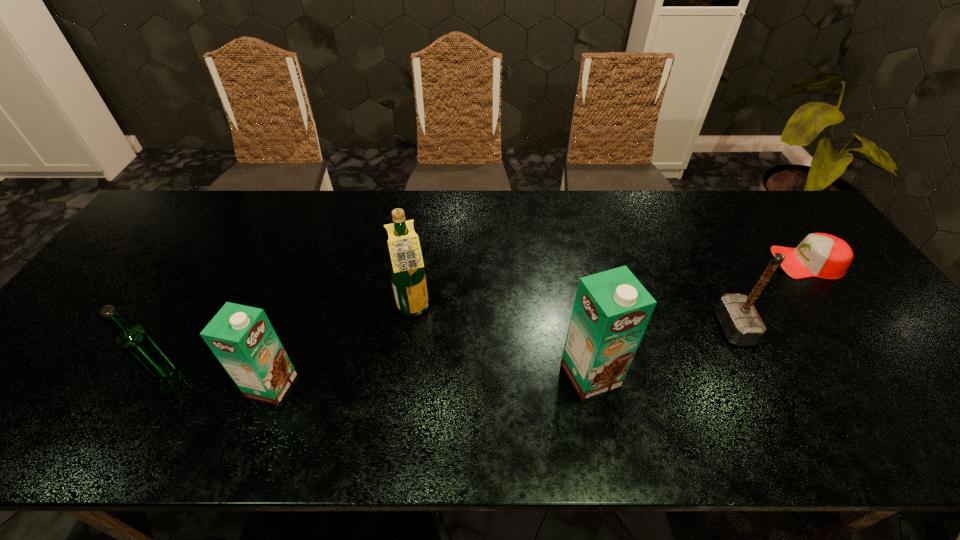
Identify the location of object at the right edge. (822, 255).

At what (x,y) coordinates should I click in order to perform the action: click on free point at the far edge. Please return your answer as a coordinate pair (x, y). This screenshot has height=540, width=960. Looking at the image, I should click on (303, 230).

You are a GUI agent. You are given a task and a screenshot of the screen. Output one action in this format:
    pyautogui.click(x=<x>, y=<y>)
    Task: Click on the vacant position at the left edge of the desktop
    This screenshot has height=540, width=960.
    Given the screenshot: What is the action you would take?
    pyautogui.click(x=154, y=249)

This screenshot has width=960, height=540. Find the location of `vacant space at the right edge`. vacant space at the right edge is located at coordinates (809, 297).

The width and height of the screenshot is (960, 540). In the image, there is a desktop. Find the location of `blank space at the far right corner`. blank space at the far right corner is located at coordinates (770, 228).

In the image, there is a desktop. At what (x,y) coordinates should I click in order to perform the action: click on vacant area at the near right corner. Please return your answer as a coordinate pair (x, y). The height and width of the screenshot is (540, 960). Looking at the image, I should click on (860, 372).

I want to click on vacant region between the beer bottle and the shortest object, so click(x=485, y=317).

At what (x,y) coordinates should I click in order to perform the action: click on free space between the leftmost object and the second object from left to right. Please return your answer as a coordinate pair (x, y). Looking at the image, I should click on (218, 379).

Find the location of a particular element. The height and width of the screenshot is (540, 960). vacant space that's between the hammer and the beer bottle is located at coordinates (448, 350).

Find the location of `empty space that is in between the taller carton and the fourth object from right to left`. empty space that is in between the taller carton and the fourth object from right to left is located at coordinates (502, 342).